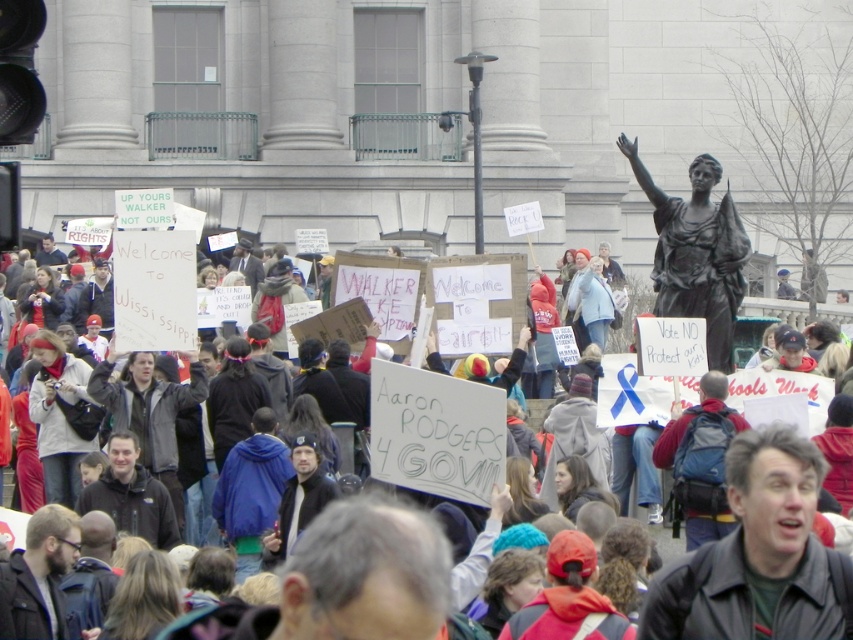
The width and height of the screenshot is (853, 640). What do you see at coordinates (758, 556) in the screenshot?
I see `black leather jacket at lower right` at bounding box center [758, 556].

Find the location of a particular element. black leather jacket at lower right is located at coordinates (758, 556).

Is point (770, 497) positioned before point (846, 570)?

That is False.

Identify the location of black leather jacket at lower right. Image resolution: width=853 pixels, height=640 pixels. (758, 556).

Is point (691, 612) positioned after point (728, 339)?

No, (691, 612) is in front of (728, 339).

In the scene shown: Who is higher up, black leather jacket at lower right or bronze statue at upper right?

bronze statue at upper right is above.

Does point (782, 552) lie in front of point (729, 276)?

Yes, it is in front of point (729, 276).

You are a GUI agent. You are given a task and a screenshot of the screen. Output one action in this format:
    pyautogui.click(x=<x>, y=<y>)
    Task: Click on the black leather jacket at lower right
    The width and height of the screenshot is (853, 640).
    Given the screenshot: What is the action you would take?
    click(x=758, y=556)

Does white cardboard sign at center have a larger size compared to bronze statue at upper right?

Indeed, white cardboard sign at center has a larger size compared to bronze statue at upper right.

Is white cardboard sign at center above bronze statue at upper right?

No.

Is point (788, 493) positioned behind point (695, 156)?

No, (788, 493) is closer to viewer.

Identify the location of white cardboard sign at center. The height and width of the screenshot is (640, 853). (788, 531).